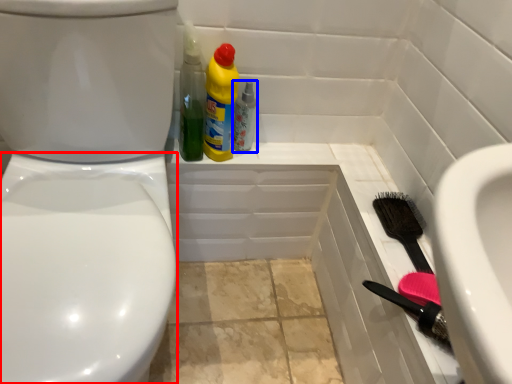
Question: Which object is closer to the camera taking this photo, bidet (highlighted by a red box) or bottle (highlighted by a blue box)?

Choices:
 (A) bidet
 (B) bottle

Answer: (A)